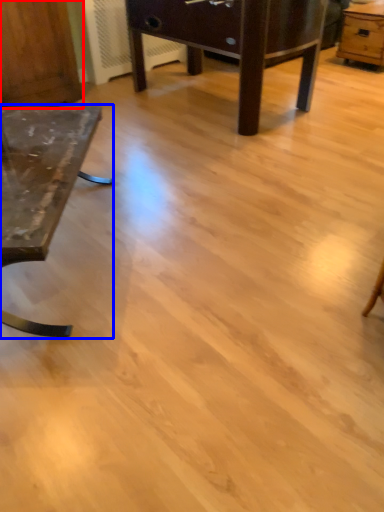
Question: Which point is further to the camera, dresser (highlighted by a red box) or table (highlighted by a blue box)?

Choices:
 (A) dresser
 (B) table

Answer: (A)